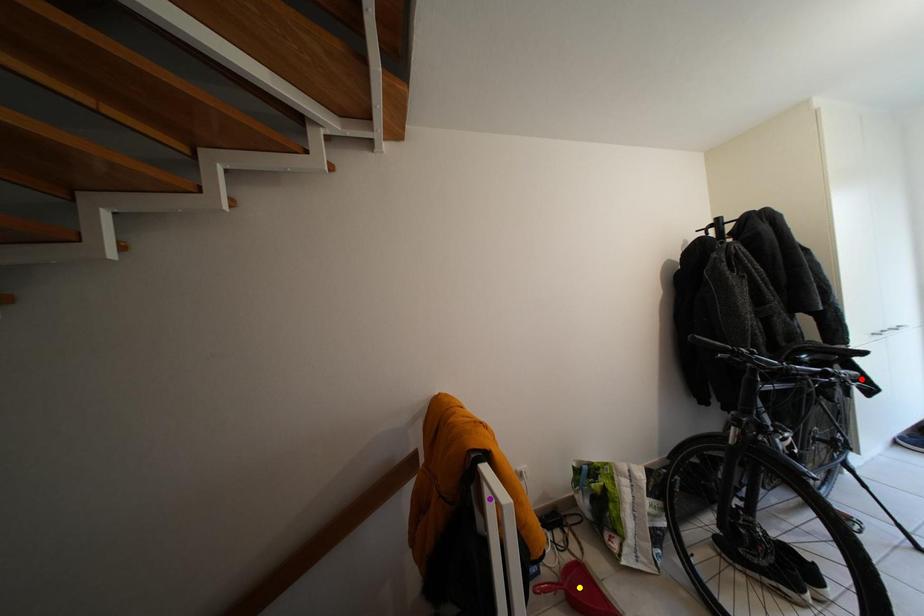
Order these from farthest to nearest:
- red point
- purple point
- yellow point

1. red point
2. yellow point
3. purple point